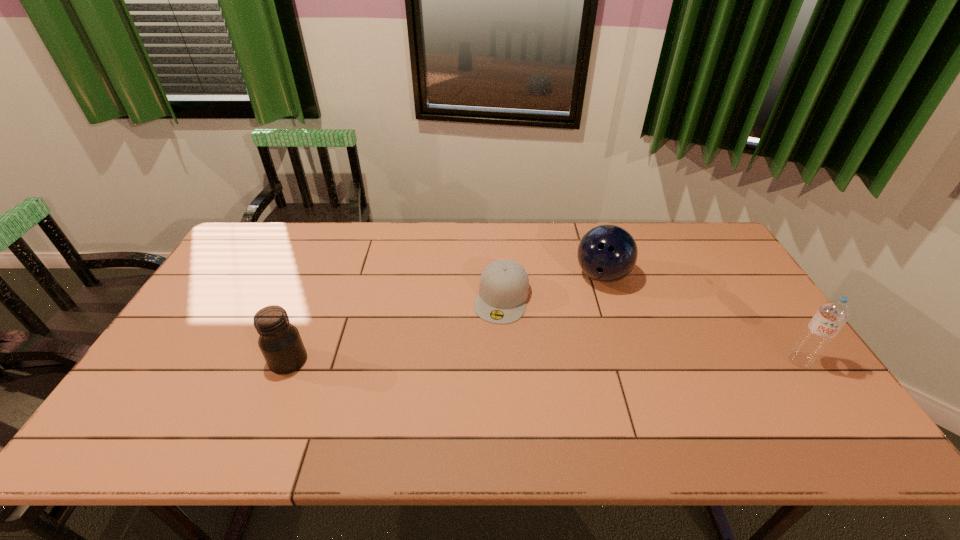
Identify the location of jar. The width and height of the screenshot is (960, 540). click(x=280, y=342).

Where is `the tallest object`? the tallest object is located at coordinates (831, 316).

Identify the location of water bottle. This screenshot has height=540, width=960. (831, 316).

Find the location of `the second object from right to left`. the second object from right to left is located at coordinates (607, 253).

What are the coordinates of `the second object from left to right` in the screenshot? It's located at (504, 284).

The image size is (960, 540). I want to click on the shortest object, so click(504, 284).

Locate an element on the screen. vacant space situated 0.080m on the back of the jar is located at coordinates (303, 325).

What are the coordinates of `free space located 0.290m on the back of the water bottle` in the screenshot? It's located at (745, 280).

The image size is (960, 540). What are the coordinates of `blank area located 0.270m on the surface of the bowling ball near the finger holes` in the screenshot? It's located at (612, 366).

Locate an element on the screen. The image size is (960, 540). free space located 0.140m on the surface of the bowling ball near the finger holes is located at coordinates (608, 328).